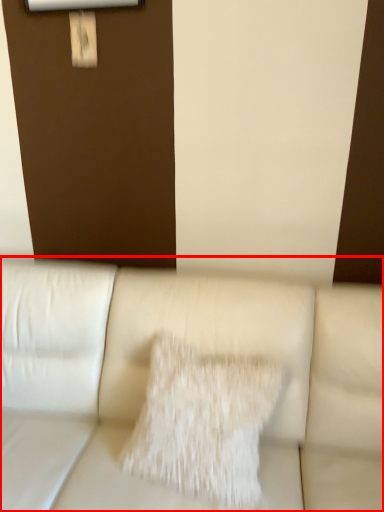
Question: From the image's perspective, considering the relative positions of studio couch (annotated by the red box) and pillow in the image provided, where is studio couch (annotated by the red box) located with respect to the staircase?

Choices:
 (A) below
 (B) above

Answer: (A)